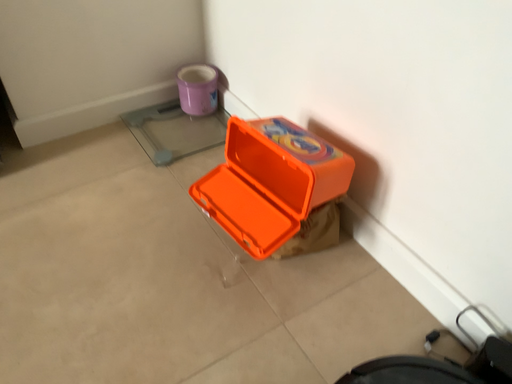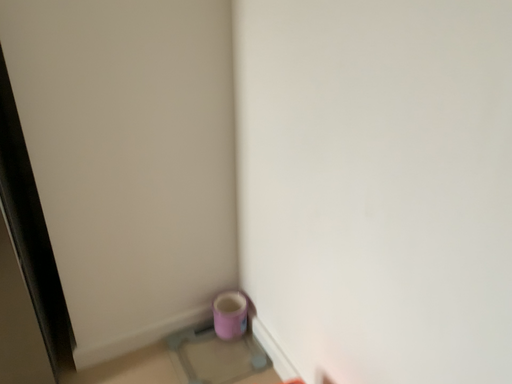
Question: Which way did the camera rotate in the video?

Choices:
 (A) rotated upward
 (B) rotated downward

Answer: (A)